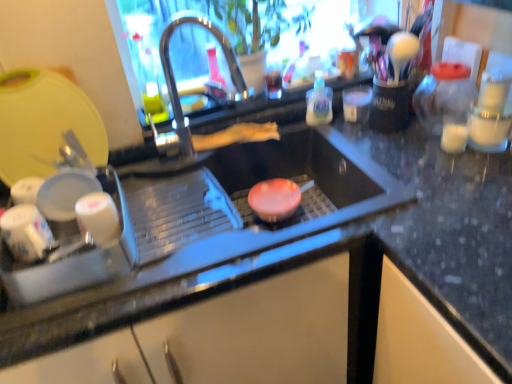
Question: Considering the relative positions of translucent plastic bottle at upper right and yellow plastic cutting board at upper left, which is the 1th appliance in top-to-bottom order, in the image provided, is translucent plastic bottle at upper right to the right of yellow plastic cutting board at upper left, which is the 1th appliance in top-to-bottom order, from the viewer's perspective?

Choices:
 (A) no
 (B) yes

Answer: (B)

Question: Is translucent plastic bottle at upper right thinner than yellow plastic cutting board at upper left, which is the 1th appliance in top-to-bottom order?

Choices:
 (A) no
 (B) yes

Answer: (A)

Question: Considering the relative sizes of translucent plastic bottle at upper right and yellow plastic cutting board at upper left, the 2th appliance from the bottom, in the image provided, is translucent plastic bottle at upper right taller than yellow plastic cutting board at upper left, the 2th appliance from the bottom,?

Choices:
 (A) yes
 (B) no

Answer: (B)

Question: Does translucent plastic bottle at upper right have a larger size compared to yellow plastic cutting board at upper left, which is the 1th appliance in top-to-bottom order?

Choices:
 (A) yes
 (B) no

Answer: (B)

Question: From the image's perspective, is translucent plastic bottle at upper right over yellow plastic cutting board at upper left, the 2th appliance from the bottom?

Choices:
 (A) no
 (B) yes

Answer: (B)

Question: Can you confirm if translucent plastic bottle at upper right is wider than yellow plastic cutting board at upper left, which is the 1th appliance in top-to-bottom order?

Choices:
 (A) yes
 (B) no

Answer: (A)

Question: Is white glossy cups at left, the 1th appliance in the bottom-to-top sequence, aimed at translucent plastic bottle at upper right?

Choices:
 (A) no
 (B) yes

Answer: (A)

Question: From a real-world perspective, is white glossy cups at left, which is the second appliance in top-to-bottom order, over translucent plastic bottle at upper right?

Choices:
 (A) no
 (B) yes

Answer: (A)

Question: Does white glossy cups at left, the 1th appliance in the bottom-to-top sequence, appear on the left side of translucent plastic bottle at upper right?

Choices:
 (A) no
 (B) yes

Answer: (B)

Question: Is white glossy cups at left, which is the second appliance in top-to-bottom order, smaller than translucent plastic bottle at upper right?

Choices:
 (A) no
 (B) yes

Answer: (A)

Question: Can you confirm if white glossy cups at left, which is the second appliance in top-to-bottom order, is taller than translucent plastic bottle at upper right?

Choices:
 (A) no
 (B) yes

Answer: (A)

Question: Are white glossy cups at left, which is the second appliance in top-to-bottom order, and translucent plastic bottle at upper right located far from each other?

Choices:
 (A) yes
 (B) no

Answer: (B)

Question: From the image's perspective, does white glossy cups at left, which is the second appliance in top-to-bottom order, appear lower than yellow plastic cutting board at upper left, which is the 1th appliance in top-to-bottom order?

Choices:
 (A) no
 (B) yes

Answer: (B)